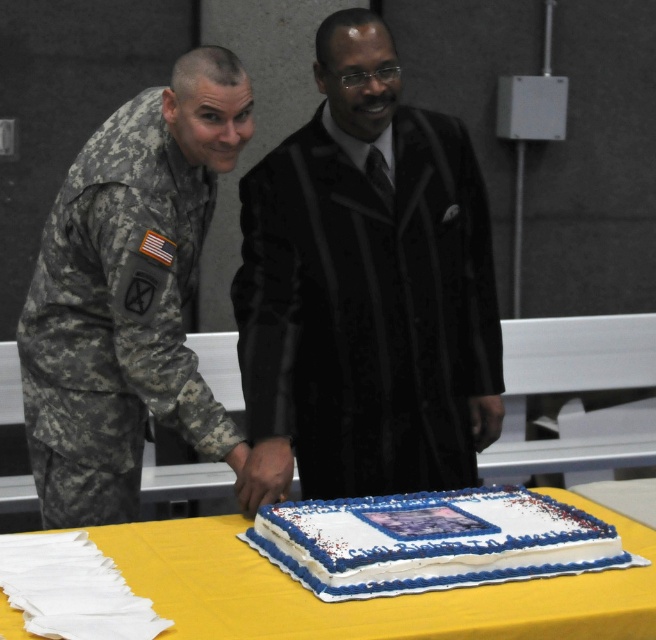
Does black silk suit at center appear on the left side of white frosted sheet cake at center?

Yes, black silk suit at center is to the left of white frosted sheet cake at center.

Between point (266, 275) and point (464, 497), which one is positioned behind?

The point (266, 275) is more distant.

At what (x,y) coordinates should I click in order to perform the action: click on black silk suit at center. Please return your answer as a coordinate pair (x, y). Looking at the image, I should click on (365, 291).

Between black silk suit at center and white frosted cake at center, which one appears on the right side from the viewer's perspective?

Positioned to the right is white frosted cake at center.

The image size is (656, 640). What do you see at coordinates (365, 291) in the screenshot?
I see `black silk suit at center` at bounding box center [365, 291].

Is point (428, 294) positioned after point (626, 525)?

That is True.

Identify the location of black silk suit at center. (365, 291).

Is camouflage fabric uniform at left positioned before white frosted sheet cake at center?

No, it is not.

Which is behind, point (56, 308) or point (512, 544)?

The point (56, 308) is more distant.

Measure the distance between point [144,118] and camera.

A distance of 2.34 meters exists between point [144,118] and camera.

You are a GUI agent. You are given a task and a screenshot of the screen. Output one action in this format:
    pyautogui.click(x=<x>, y=<y>)
    Task: Click on the camouflage fabric uniform at left
    This screenshot has width=656, height=640.
    Given the screenshot: What is the action you would take?
    pyautogui.click(x=115, y=320)